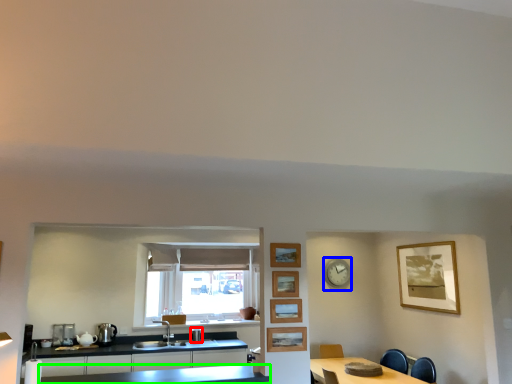
Question: Which is farther away from appliance (highlighted by a red box)? clock (highlighted by a blue box) or countertop (highlighted by a green box)?

Choices:
 (A) clock
 (B) countertop

Answer: (A)